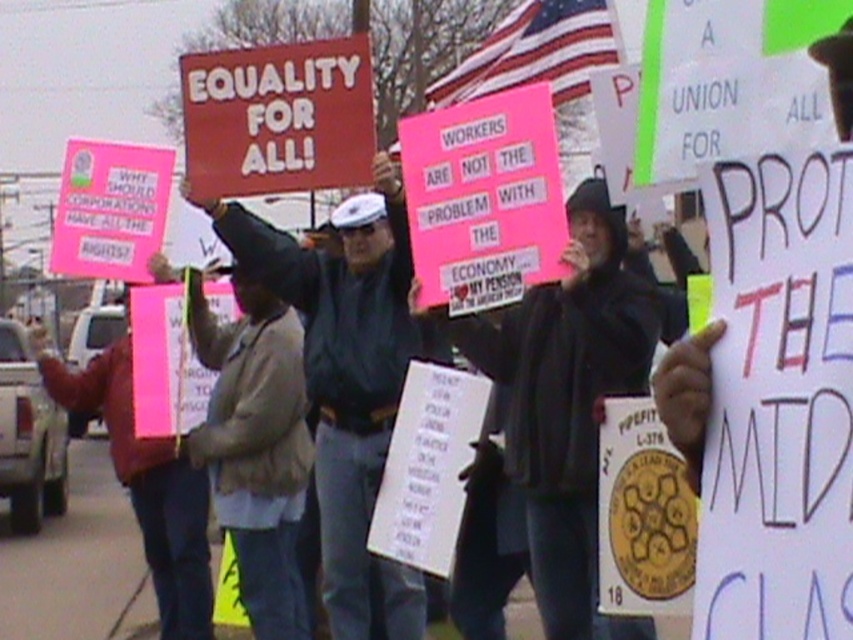
Is point (341, 403) more distant than point (247, 112)?

Yes, it is.

Does dark gray uniform at center appear over red matte sign at center?

No.

Does point (387, 337) lie behind point (286, 141)?

Yes, it is behind point (286, 141).

The width and height of the screenshot is (853, 640). I want to click on dark gray uniform at center, so click(347, 380).

Which is more to the right, dark gray uniform at center or tan suede jacket at center?

dark gray uniform at center

Is point (367, 273) behind point (271, 401)?

Yes.

Does point (398, 384) come behind point (279, 384)?

Yes, point (398, 384) is behind point (279, 384).

The image size is (853, 640). What are the coordinates of `dark gray uniform at center` in the screenshot? It's located at (347, 380).

Who is positioned more to the right, tan suede jacket at center or red matte sign at center?

Positioned to the right is red matte sign at center.

This screenshot has width=853, height=640. What do you see at coordinates (256, 445) in the screenshot?
I see `tan suede jacket at center` at bounding box center [256, 445].

Which is behind, point (294, 636) or point (271, 163)?

The point (294, 636) is more distant.

Find the location of a particular element. tan suede jacket at center is located at coordinates click(x=256, y=445).